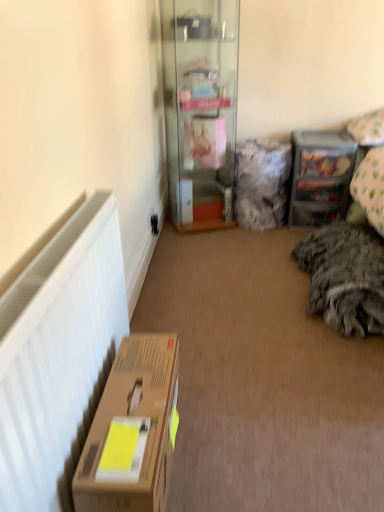
Question: Is dark gray textured blanket at right inside the boundaries of clear glass cabinet at center, or outside?

Choices:
 (A) outside
 (B) inside

Answer: (A)

Question: Considering their positions, is dark gray textured blanket at right located in front of or behind clear glass cabinet at center?

Choices:
 (A) front
 (B) behind

Answer: (A)

Question: Estimate the real-world distances between objects in this image. Which object is farther from the dark gray textured blanket at right?

Choices:
 (A) clear plastic drawers at upper right
 (B) white matte radiator at left
 (C) fuzzy fabric pillow at center, which ranks as the 2th pillow in right-to-left order
 (D) brown cardboard box at lower left
 (E) clear glass cabinet at center

Answer: (B)

Question: Which object is positioned farthest from the white matte radiator at left?

Choices:
 (A) white fabric pillow at upper right, acting as the second pillow starting from the left
 (B) brown cardboard box at lower left
 (C) dark gray textured blanket at right
 (D) clear glass cabinet at center
 (E) fuzzy fabric pillow at center, marked as the first pillow in a left-to-right arrangement

Answer: (A)